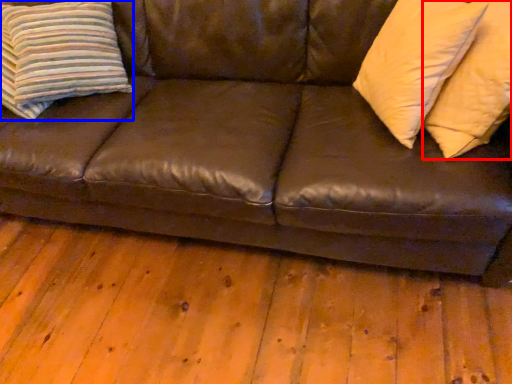
Question: Which point is further to the camera, pillow (highlighted by a red box) or pillow (highlighted by a blue box)?

Choices:
 (A) pillow
 (B) pillow

Answer: (B)